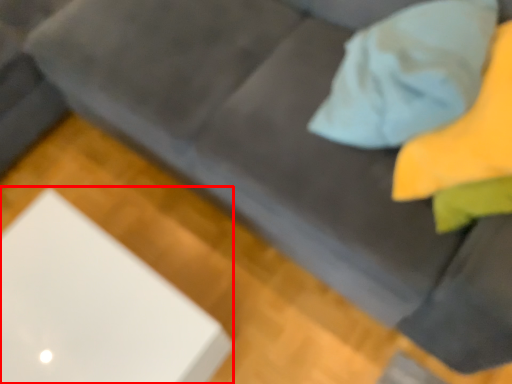
Question: From the image's perspective, what is the correct spatial relationship of computer (annotated by the red box) in relation to throw pillow?

Choices:
 (A) above
 (B) below

Answer: (B)